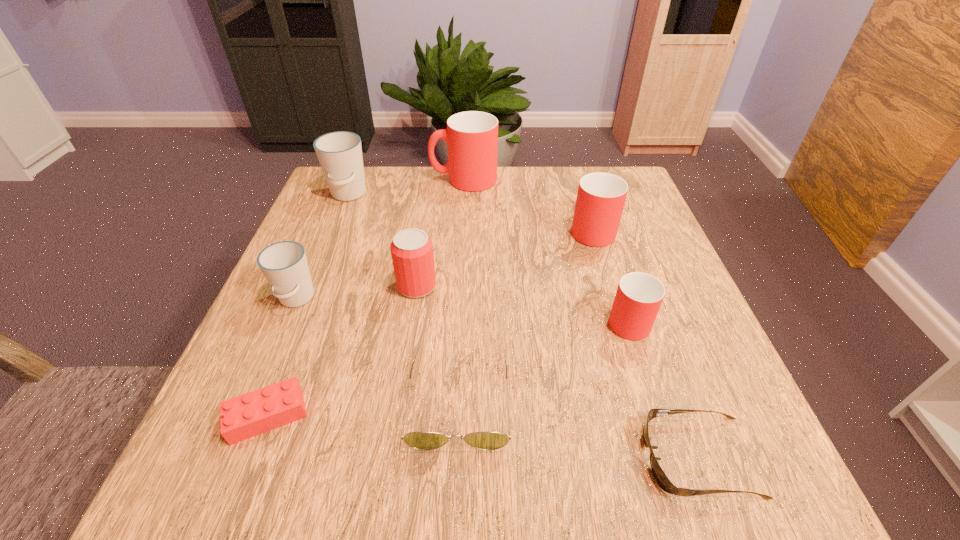
You are a GUI agent. You are given a task and a screenshot of the screen. Output one action in this format:
    pyautogui.click(x=<x>, y=<y>)
    Task: Click on the free space between the nearer white cup and the second smallest red cup
    
    Given the screenshot: What is the action you would take?
    pyautogui.click(x=444, y=264)

Identify which object is the closest to the leftmost red cup. Please provide its 2D coordinates. Your answer should be formatted as a tuple, i.e. [(x, y)], where the tuple contains the x and y coordinates of a point satisfying the conditions above.

[(339, 153)]

Identify the location of object that is the second closest to the third farthest object. (472, 137).

Choose which cup is the nearest neighbor to the left sunglasses. Please provide its 2D coordinates. Your answer should be formatted as a tuple, i.e. [(x, y)], where the tuple contains the x and y coordinates of a point satisfying the conditions above.

[(639, 296)]

Point out which cup is positioned as the fifth nearest to the red beer can. Please provide its 2D coordinates. Your answer should be formatted as a tuple, i.e. [(x, y)], where the tuple contains the x and y coordinates of a point satisfying the conditions above.

[(639, 296)]

Locate an element on the screen. red cup that is the second closest to the smallest red cup is located at coordinates (472, 137).

Locate which red cup ranks third in proximity to the Lego. Please provide its 2D coordinates. Your answer should be formatted as a tuple, i.e. [(x, y)], where the tuple contains the x and y coordinates of a point satisfying the conditions above.

[(472, 137)]

Locate an element on the screen. The width and height of the screenshot is (960, 540). free space that satisfies the following two spatial constraints: 1. with a handle on the side of the red Lego; 2. on the right side of the nearer white cup is located at coordinates (247, 416).

You are a GUI agent. You are given a task and a screenshot of the screen. Output one action in this format:
    pyautogui.click(x=<x>, y=<y>)
    Task: Click on the free space that satisfies the following two spatial constraints: 1. with a handle on the side of the smaller white cup; 2. on the right side of the Lego
    The width and height of the screenshot is (960, 540).
    Given the screenshot: What is the action you would take?
    (x=247, y=416)